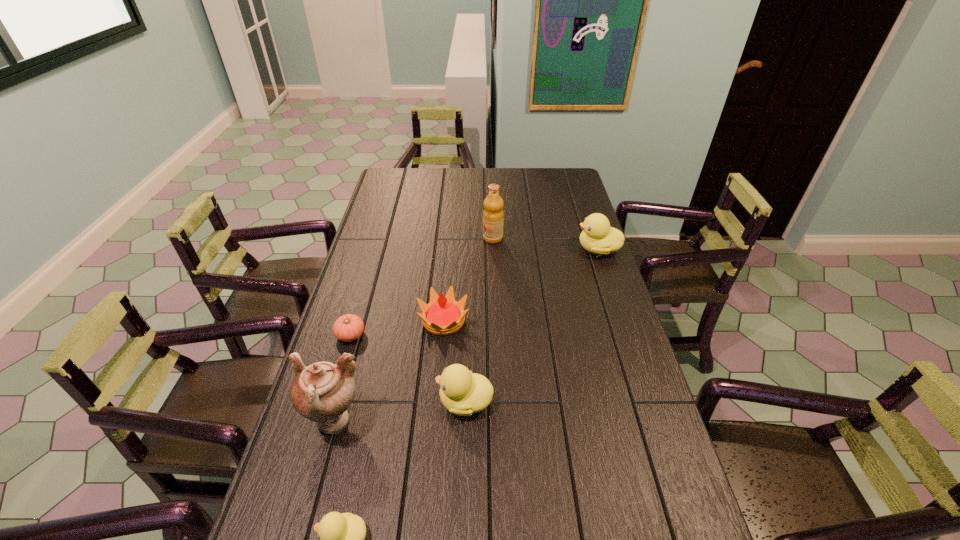
Image resolution: width=960 pixels, height=540 pixels. In order to click on object that ranks as the fourth closest to the sixth tallest object in this screenshot , I will do `click(443, 315)`.

Where is `the closest duckling to the tomato`? This screenshot has height=540, width=960. the closest duckling to the tomato is located at coordinates (461, 392).

Find the location of a particular element. This screenshot has width=960, height=540. duckling that stands as the third closest to the crown is located at coordinates (341, 536).

Find the location of a particular element. The image size is (960, 540). vacant space that satisfies the following two spatial constraints: 1. at the beak of the rightmost duckling; 2. on the front side of the tomato is located at coordinates (627, 335).